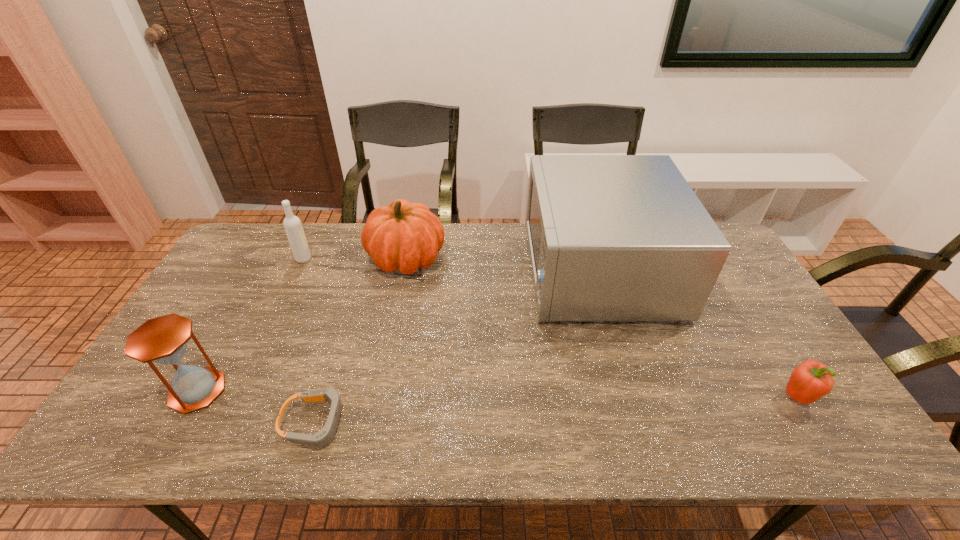
Find the location of `vacant space located 0.260m with the door open on the tallest object`. vacant space located 0.260m with the door open on the tallest object is located at coordinates (447, 269).

Find the location of a particular element. The width and height of the screenshot is (960, 540). vacant area located on the front of the pumpkin is located at coordinates (389, 349).

This screenshot has width=960, height=540. What are the coordinates of `free region located 0.100m on the back of the vodka` in the screenshot? It's located at (314, 236).

The width and height of the screenshot is (960, 540). Find the location of `vacant space located 0.350m on the back of the hourglass`. vacant space located 0.350m on the back of the hourglass is located at coordinates (260, 278).

Image resolution: width=960 pixels, height=540 pixels. Find the location of `free space located on the left of the rightmost object`. free space located on the left of the rightmost object is located at coordinates (748, 397).

This screenshot has width=960, height=540. I want to click on free space located 0.320m on the front and back of the goggles, so [486, 423].

Locate an element on the screen. The height and width of the screenshot is (540, 960). microwave oven that is at the far edge is located at coordinates (611, 237).

The image size is (960, 540). What are the coordinates of `pumpkin present at the far edge` in the screenshot? It's located at tap(404, 236).

I want to click on vodka present at the far edge, so click(292, 224).

Find the location of `object at the near edge`. object at the near edge is located at coordinates (323, 437).